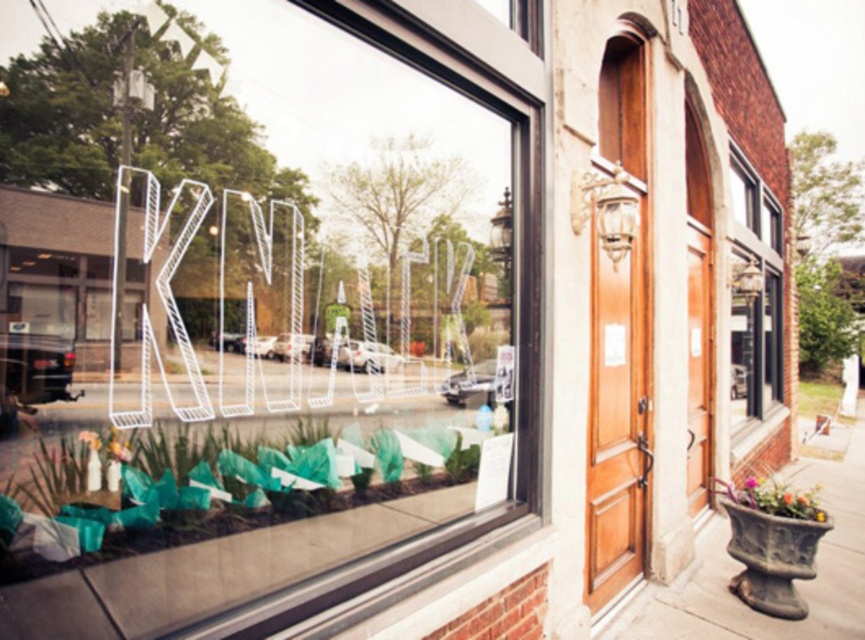
Between point (747, 330) and point (723, 481), which one is positioned in front?

Point (723, 481)

Which of these two, clear glass window at upper right or multicolored ceramic pot at lower right, stands shorter?

With less height is multicolored ceramic pot at lower right.

The image size is (865, 640). What do you see at coordinates (755, 305) in the screenshot? I see `clear glass window at upper right` at bounding box center [755, 305].

The width and height of the screenshot is (865, 640). I want to click on clear glass window at upper right, so click(x=755, y=305).

Which is more to the right, green leafy plant at lower left or multicolored ceramic pot at lower right?

multicolored ceramic pot at lower right is more to the right.

Between point (452, 458) and point (817, 492), which one is positioned behind?

Positioned behind is point (817, 492).

The height and width of the screenshot is (640, 865). I want to click on green leafy plant at lower left, so click(x=221, y=486).

Which is more to the left, smooth concrete pavement at lower right or clear glass window at upper right?

From the viewer's perspective, smooth concrete pavement at lower right appears more on the left side.

Identify the location of smooth concrete pavement at lower right. This screenshot has height=640, width=865. (741, 564).

Measure the distance between point (722, 547) and camera.

The distance of point (722, 547) from camera is 5.88 meters.

Where is `smooth concrete pavement at lower right`? This screenshot has height=640, width=865. smooth concrete pavement at lower right is located at coordinates (741, 564).